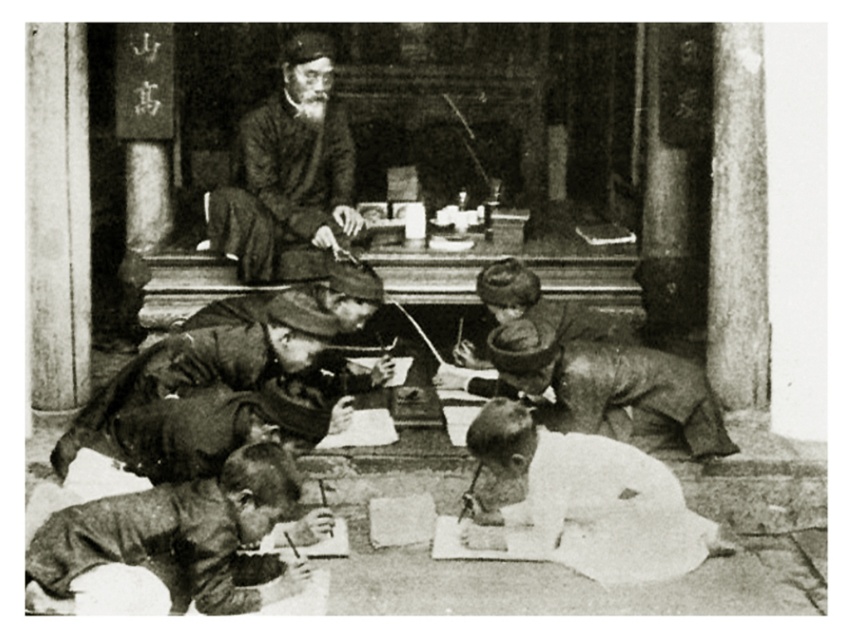
Which is behind, point (754, 346) or point (348, 262)?

Point (348, 262)

Which of these two, smooth stone pillar at right or smooth brown hat at center, stands taller?

smooth stone pillar at right

Which is in front, point (755, 216) or point (375, 300)?

Positioned in front is point (755, 216).

At what (x,y) coordinates should I click in order to perform the action: click on smooth stone pillar at right. Please return your answer as a coordinate pair (x, y). The image size is (850, 640). Looking at the image, I should click on (738, 221).

Is dark brown textured robe at center further to the viewer compared to smooth brown hat at center?

That is True.

Can you confirm if dark brown textured robe at center is taller than smooth brown hat at center?

Yes, dark brown textured robe at center is taller than smooth brown hat at center.

Image resolution: width=850 pixels, height=640 pixels. Describe the element at coordinates (289, 173) in the screenshot. I see `dark brown textured robe at center` at that location.

Locate an element on the screen. This screenshot has width=850, height=640. dark brown textured robe at center is located at coordinates (289, 173).

Does white paper at lower center appear under smooth brown hat at center?

Yes, white paper at lower center is below smooth brown hat at center.

Does white paper at lower center have a lesser width compared to smooth brown hat at center?

No.

Is point (620, 509) closer to viewer compared to point (337, 300)?

Yes, point (620, 509) is closer to viewer.

Image resolution: width=850 pixels, height=640 pixels. I want to click on white paper at lower center, so click(x=587, y=499).